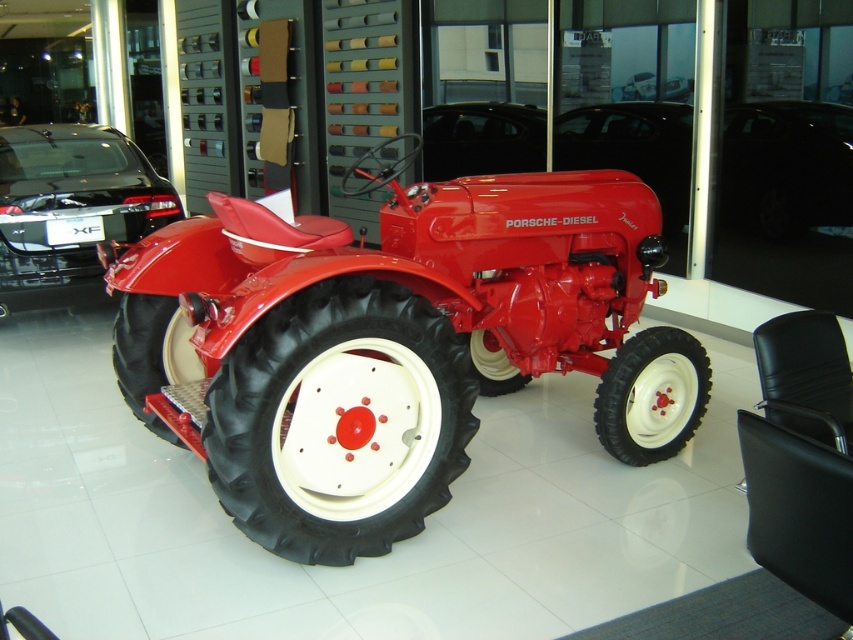
You are standing in a showroom and see the shiny black car at center and the white rubber tire at center. Based on their positions, which object is closer to the entrance of the showroom?

The white rubber tire at center is closer to the entrance because the shiny black car at center is to the right of it, implying the tire is positioned between the entrance and the car.

From the picture: You are standing next to a matte red tractor at center in a showroom. You want to take a photo of it with your smartphone camera. If your phone has a 12mm lens, what is the maximum distance you can be from the tractor to ensure it fits entirely in the frame? Assume the tractor is 12 feet long and your phone can capture a 60 degree field of view.

To determine if the matte red tractor at center fits in the frame, calculate the minimum distance required using the formula for field of view. With a 60 degree angle and tractor length of 12 feet, the minimum distance needed is 12 feet divided by the tangent of 30 degrees. This results in approximately 20.78 feet. Since you are only 8.34 feet away, the tractor will easily fit within the 60 degree field of view.